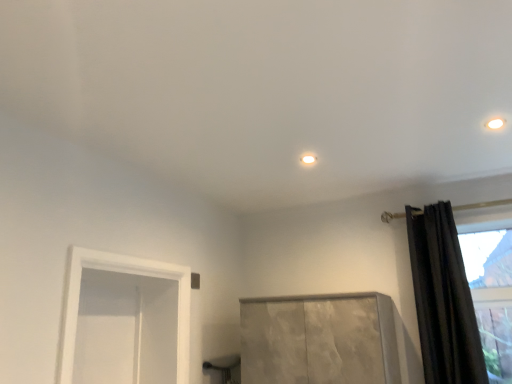
Question: Does white glossy light fixture at center, positioned as the second lighting in top-to-bottom order, have a larger size compared to matte white light fixture at upper right, arranged as the first lighting when viewed from the front?

Choices:
 (A) yes
 (B) no

Answer: (B)

Question: From a real-world perspective, is white glossy light fixture at center, marked as the 1th lighting in a back-to-front arrangement, positioned under matte white light fixture at upper right, positioned as the 1th lighting in top-to-bottom order, based on gravity?

Choices:
 (A) no
 (B) yes

Answer: (A)

Question: Does white glossy light fixture at center, the second lighting positioned from the front, appear on the left side of matte white light fixture at upper right, arranged as the second lighting when viewed from the back?

Choices:
 (A) yes
 (B) no

Answer: (A)

Question: Would you say white glossy light fixture at center, positioned as the second lighting in top-to-bottom order, is a long distance from matte white light fixture at upper right, arranged as the second lighting when viewed from the back?

Choices:
 (A) no
 (B) yes

Answer: (A)

Question: From the image's perspective, is white glossy light fixture at center, which appears as the first lighting when viewed from the left, under matte white light fixture at upper right, the second lighting when ordered from bottom to top?

Choices:
 (A) no
 (B) yes

Answer: (B)

Question: Does white glossy light fixture at center, the second lighting when ordered from right to left, have a lesser width compared to matte white light fixture at upper right, positioned as the 1th lighting in top-to-bottom order?

Choices:
 (A) no
 (B) yes

Answer: (B)

Question: Does black velvet curtain at right have a greater width compared to matte white light fixture at upper right, positioned as the 1th lighting in top-to-bottom order?

Choices:
 (A) yes
 (B) no

Answer: (A)

Question: Is black velvet curtain at right located outside matte white light fixture at upper right, arranged as the first lighting when viewed from the front?

Choices:
 (A) no
 (B) yes

Answer: (B)

Question: Is black velvet curtain at right closer to the viewer compared to matte white light fixture at upper right, arranged as the first lighting when viewed from the front?

Choices:
 (A) yes
 (B) no

Answer: (B)

Question: Is black velvet curtain at right thinner than matte white light fixture at upper right, arranged as the first lighting when viewed from the front?

Choices:
 (A) no
 (B) yes

Answer: (A)

Question: From the image's perspective, does black velvet curtain at right appear higher than matte white light fixture at upper right, positioned as the 1th lighting in top-to-bottom order?

Choices:
 (A) no
 (B) yes

Answer: (A)

Question: Does black velvet curtain at right turn towards matte white light fixture at upper right, arranged as the first lighting when viewed from the front?

Choices:
 (A) no
 (B) yes

Answer: (A)

Question: Would you say matte white light fixture at upper right, the second lighting when ordered from bottom to top, is a long distance from white glossy light fixture at center, marked as the 1th lighting in a back-to-front arrangement?

Choices:
 (A) no
 (B) yes

Answer: (A)